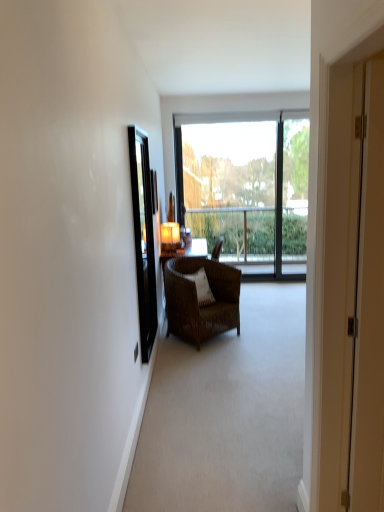
Question: From a real-world perspective, is black glass screen door at left, the 2th screen door viewed from the right, physically located above or below white textured pillow at center?

Choices:
 (A) above
 (B) below

Answer: (A)

Question: Is black glass screen door at left, placed as the first screen door when sorted from back to front, taller or shorter than white textured pillow at center?

Choices:
 (A) short
 (B) tall

Answer: (B)

Question: Estimate the real-world distances between objects in this image. Which object is closer to the white textured pillow at center?

Choices:
 (A) white wood screen door at right, the second screen door when ordered from back to front
 (B) black glass screen door at left, placed as the first screen door when sorted from back to front
 (C) brown wicker chair at center
 (D) matte glass lampshade at upper center
 (E) transparent glass window at center

Answer: (C)

Question: Considering the real-world distances, which object is closest to the brown wicker chair at center?

Choices:
 (A) transparent glass window at center
 (B) matte glass lampshade at upper center
 (C) white textured pillow at center
 (D) white wood screen door at right, the second screen door when ordered from back to front
 (E) black glass screen door at left, which is the first screen door in left-to-right order

Answer: (C)